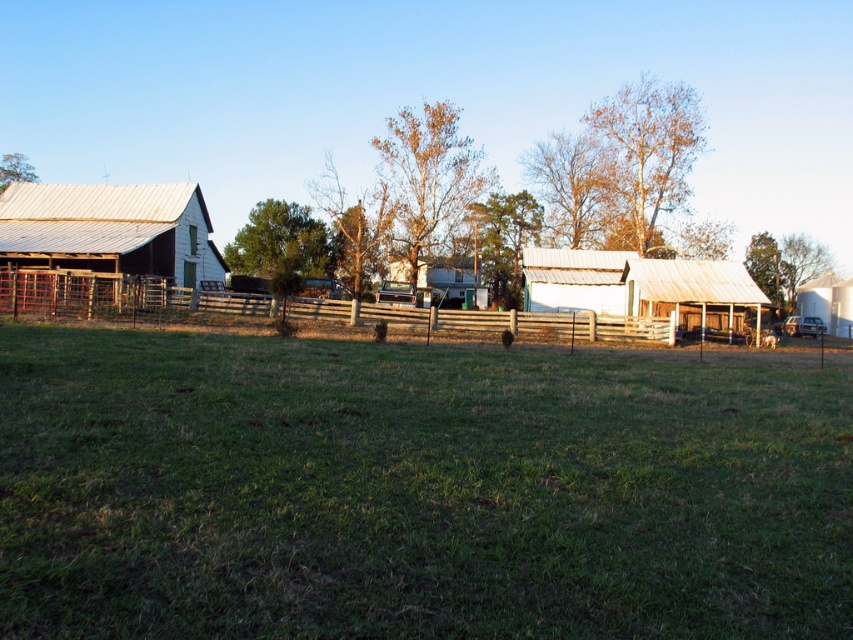
Does white corrugated metal barn at left have a larger size compared to white matte silo at right?

Correct, white corrugated metal barn at left is larger in size than white matte silo at right.

Does point (202, 227) come behind point (813, 308)?

No, it is not.

What are the coordinates of `white corrugated metal barn at left` in the screenshot? It's located at (102, 246).

Does white corrugated metal barn at center have a lesser width compared to white matte silo at right?

No.

Can you confirm if white corrugated metal barn at center is positioned above white matte silo at right?

Correct, white corrugated metal barn at center is located above white matte silo at right.

Locate an element on the screen. This screenshot has width=853, height=640. white corrugated metal barn at center is located at coordinates (642, 285).

This screenshot has width=853, height=640. Find the location of `white corrugated metal barn at center`. white corrugated metal barn at center is located at coordinates (642, 285).

Does green grassy field at center have a smaller size compared to wooden fence at center?

Indeed, green grassy field at center has a smaller size compared to wooden fence at center.

Is point (140, 413) positioned after point (404, 316)?

No, it is in front of (404, 316).

Between point (386, 541) and point (390, 317), which one is positioned behind?

Positioned behind is point (390, 317).

Image resolution: width=853 pixels, height=640 pixels. What are the coordinates of `green grassy field at center` in the screenshot? It's located at [x=416, y=490].